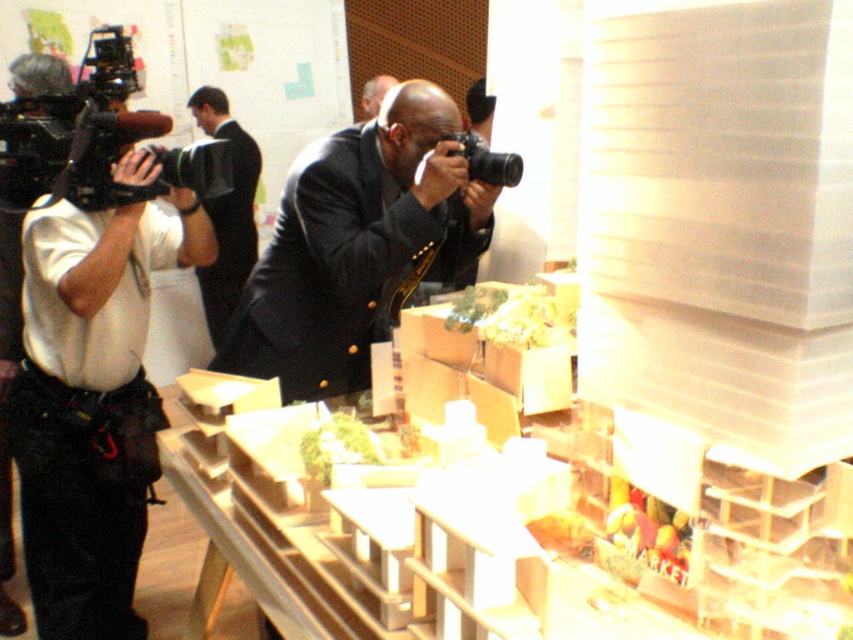
You are standing in the conference room and need to locate the white shirt at left. According to the coordinates provided, where exactly should you look to find it?

The white shirt at left is located at point 0.623 on the x axis and 0.111 on the y axis.

You are an event organizer who needs to place a 1.2 meter wide banner between the dark gray suit at center and the black suit at upper left. Given their sizes, will the banner fit between them without overlapping?

The dark gray suit at center is smaller than the black suit at upper left. The banner may fit between them, but since the exact distance isn not provided, we can only confirm the banner width is 1.2 meters. However, the size comparison alone doesn not guarantee the space between them is sufficient. Further measurements are needed.